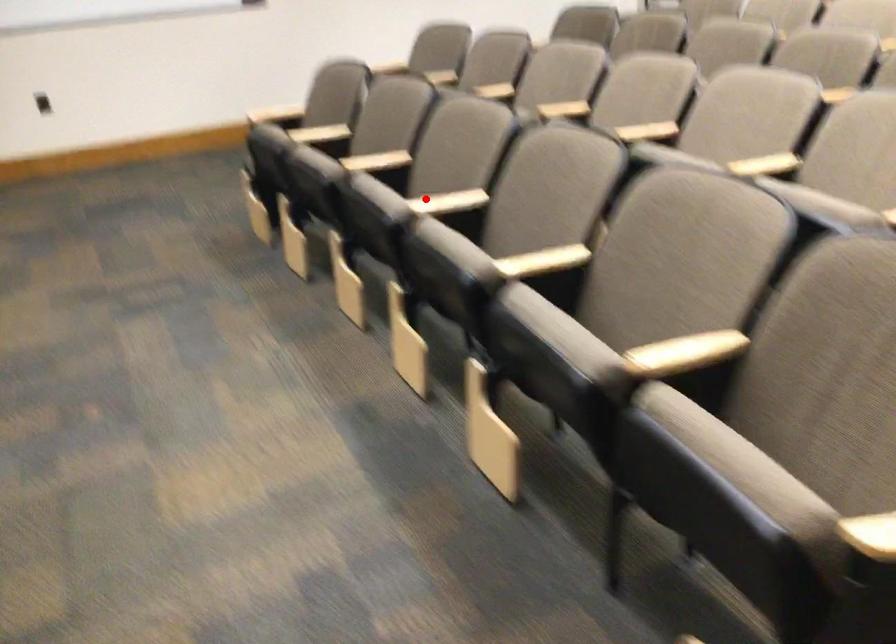
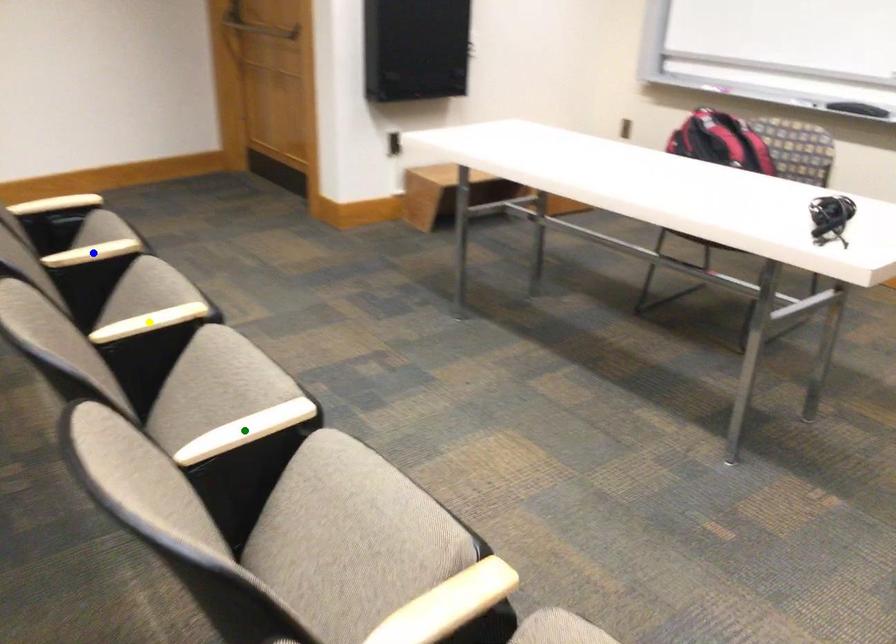
Question: I am providing you with two images of the same scene from different viewpoints. A red point is marked on the first image. You are given multiple points on the second image. Can you choose the point in image 2 that corresponds to the point in image 1?

Choices:
 (A) green point
 (B) blue point
 (C) yellow point

Answer: (A)